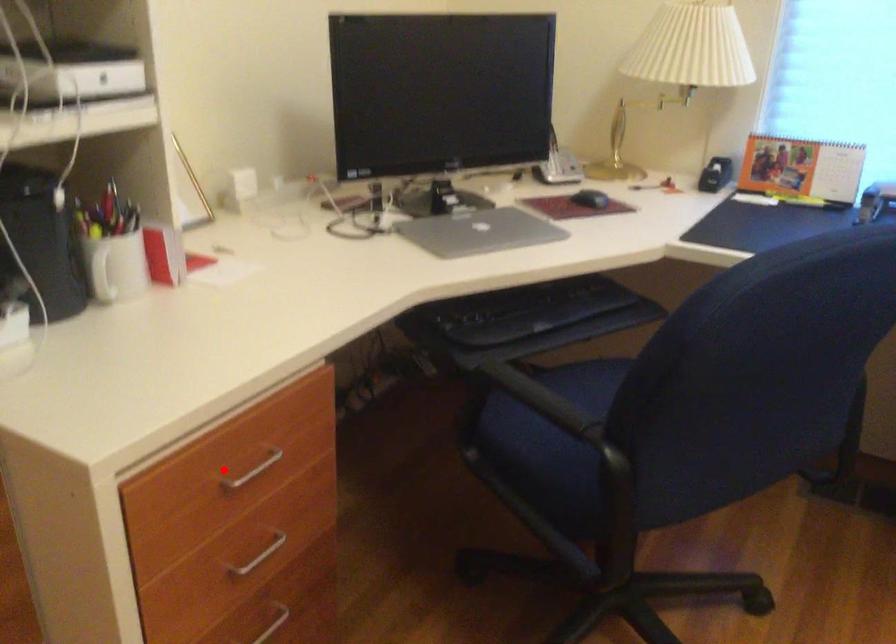
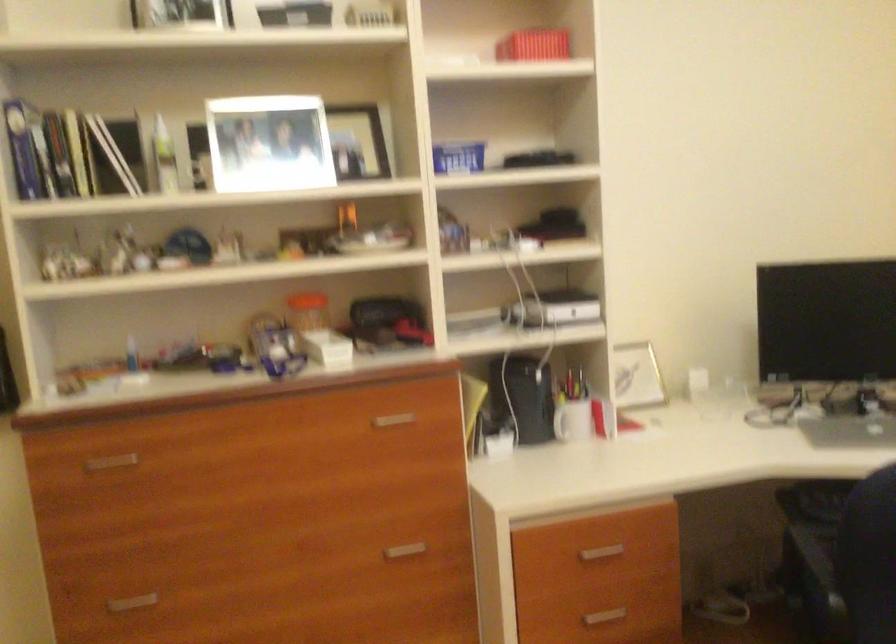
Question: I am providing you with two images of the same scene from different viewpoints. Given a red point in image1, look at the same physical point in image2. Is it:

Choices:
 (A) Closer to the viewpoint
 (B) Farther from the viewpoint

Answer: (B)